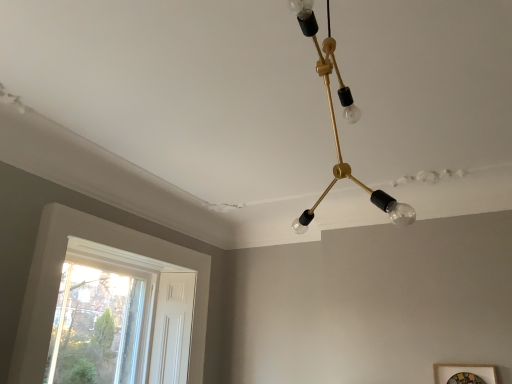
Question: Considering the relative positions of wooden picture frame at lower right and gold metallic chandelier at upper center in the image provided, is wooden picture frame at lower right to the left or to the right of gold metallic chandelier at upper center?

Choices:
 (A) right
 (B) left

Answer: (A)

Question: Is point click(486, 382) positioned closer to the camera than point click(343, 114)?

Choices:
 (A) closer
 (B) farther

Answer: (B)

Question: Estimate the real-world distances between objects in this image. Which object is closer to the gold metallic chandelier at upper center?

Choices:
 (A) white wood window at lower left
 (B) wooden picture frame at lower right

Answer: (B)

Question: Which object is positioned closest to the wooden picture frame at lower right?

Choices:
 (A) gold metallic chandelier at upper center
 (B) white wood window at lower left

Answer: (A)